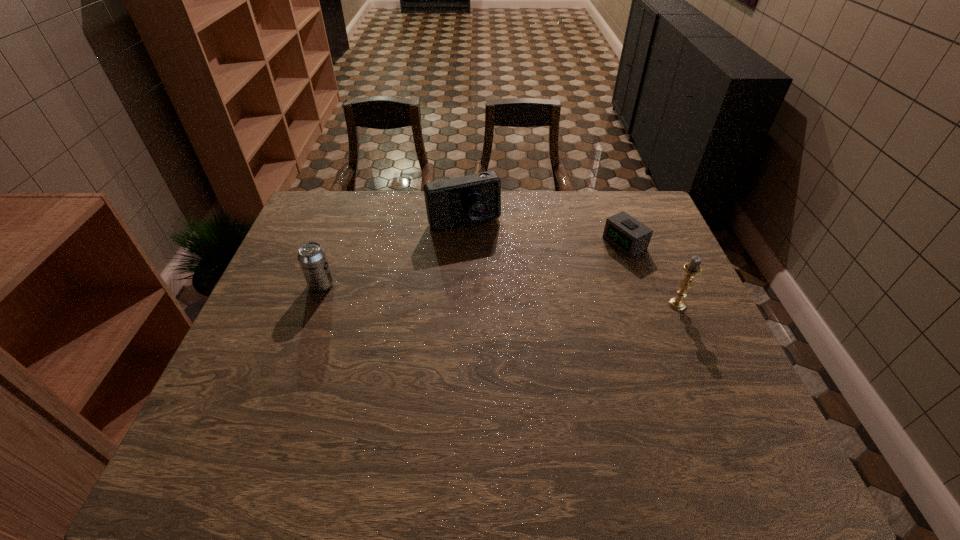
Identify the location of vacant space at the near edge of the desktop. Image resolution: width=960 pixels, height=540 pixels. (318, 418).

Where is `vacant space at the right edge of the desktop`? Image resolution: width=960 pixels, height=540 pixels. vacant space at the right edge of the desktop is located at coordinates (661, 317).

Identify the location of vacant space at the far right corner of the desktop. (625, 197).

In the image, there is a desktop. At what (x,y) coordinates should I click in order to perform the action: click on free space at the near right corner. Please return your answer as a coordinate pair (x, y). The image size is (960, 540). Looking at the image, I should click on (747, 415).

Where is `free space between the second object from left to right and the leftmost object`? free space between the second object from left to right and the leftmost object is located at coordinates (393, 253).

Where is `vacant point located between the second nearest object and the camera`? The image size is (960, 540). vacant point located between the second nearest object and the camera is located at coordinates (393, 253).

The image size is (960, 540). I want to click on vacant area between the second shortest object and the shortest object, so click(473, 264).

Locate an element on the screen. The height and width of the screenshot is (540, 960). unoccupied position between the beer can and the alarm clock is located at coordinates (473, 264).

The width and height of the screenshot is (960, 540). What are the coordinates of `empty space that is in between the alarm clock and the candle holder` in the screenshot? It's located at (651, 274).

Find the location of a particular element. blank region between the candle holder and the second nearest object is located at coordinates (499, 294).